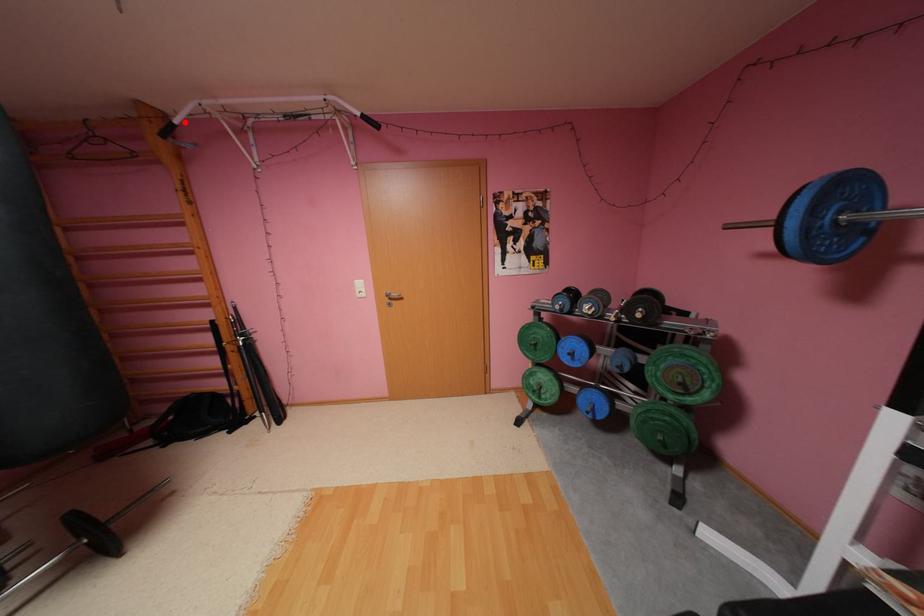
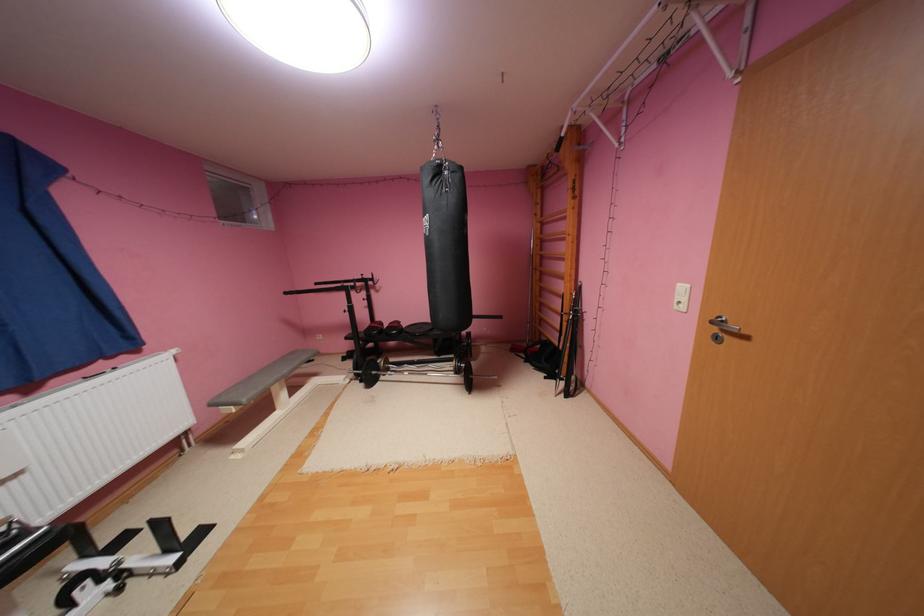
Locate, in the second image, the point that corresponds to the highlighted location in the first image.

(572, 135)